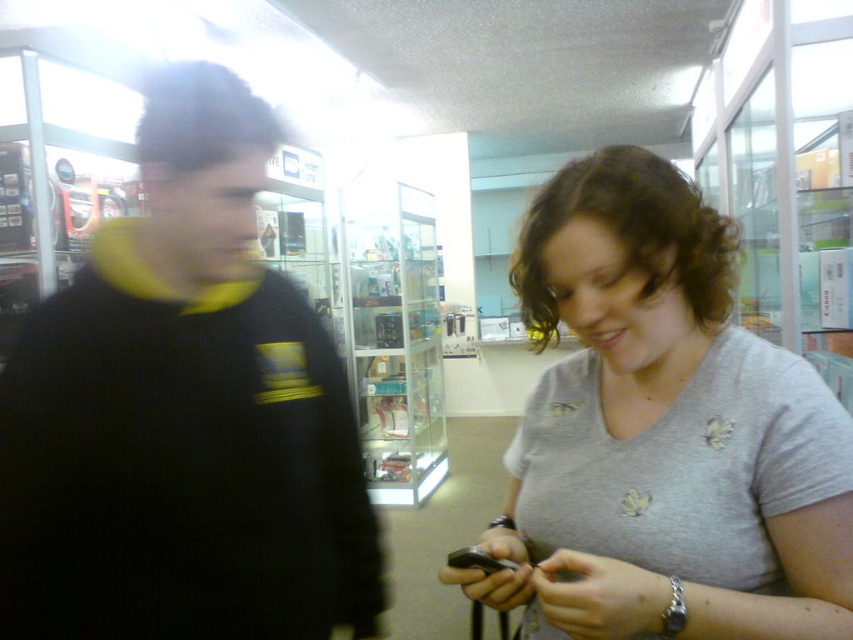
Is black/yellow sweater at left shorter than gray cotton shirt at center?

In fact, black/yellow sweater at left may be taller than gray cotton shirt at center.

Is black/yellow sweater at left positioned in front of gray cotton shirt at center?

No, black/yellow sweater at left is further to the viewer.

Where is `black/yellow sweater at left`? The width and height of the screenshot is (853, 640). black/yellow sweater at left is located at coordinates (184, 416).